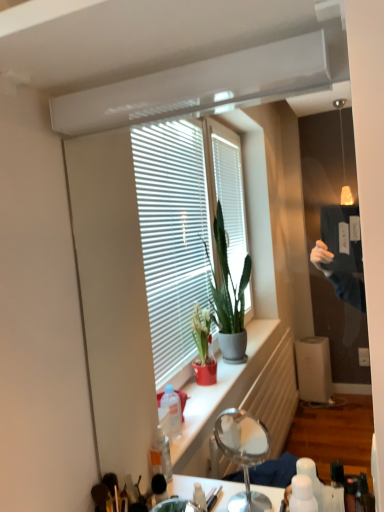
Identify the location of white matte bottle at lower right. (x=302, y=495).

What do you see at coordinates (302, 495) in the screenshot? Image resolution: width=384 pixels, height=512 pixels. I see `white matte bottle at lower right` at bounding box center [302, 495].

The image size is (384, 512). What are the coordinates of `white matte bottle at lower right` in the screenshot? It's located at (302, 495).